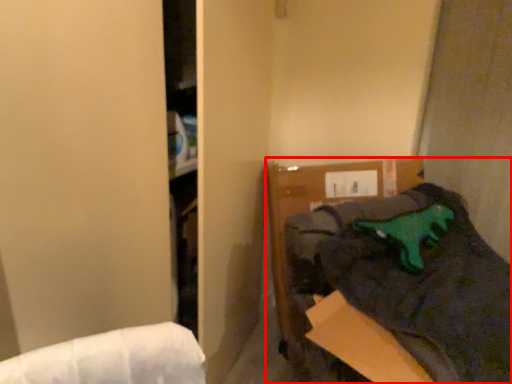
Question: From the image's perspective, considering the relative positions of furniture (annotated by the red box) and animal in the image provided, where is furniture (annotated by the red box) located with respect to the staircase?

Choices:
 (A) above
 (B) below

Answer: (B)